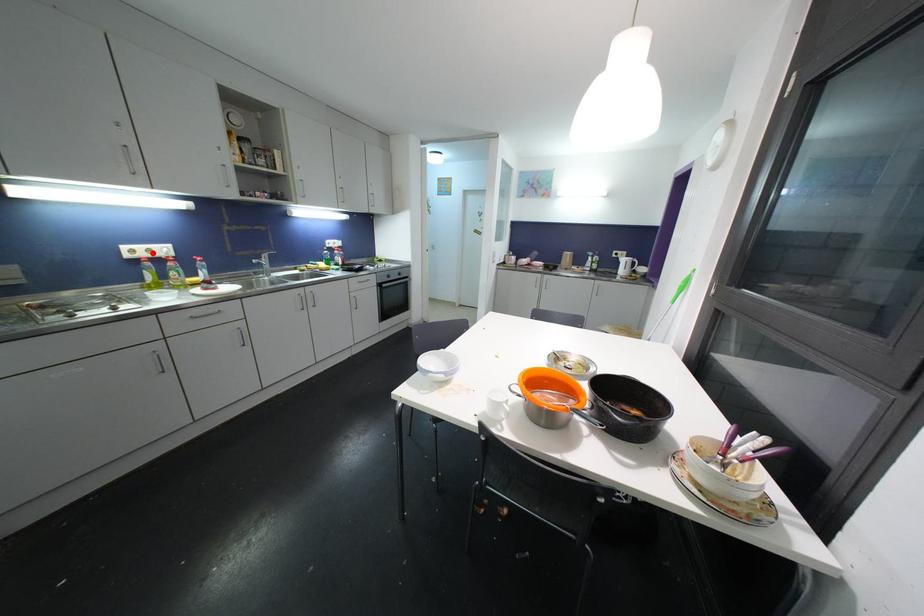
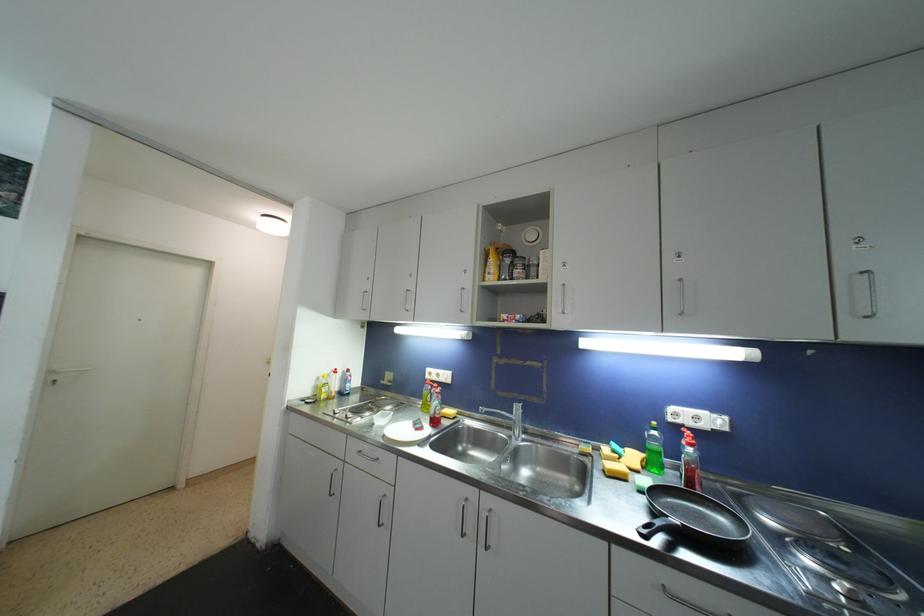
Where in the second image is the point corresponding to the highlighted location from the first image?

(441, 378)